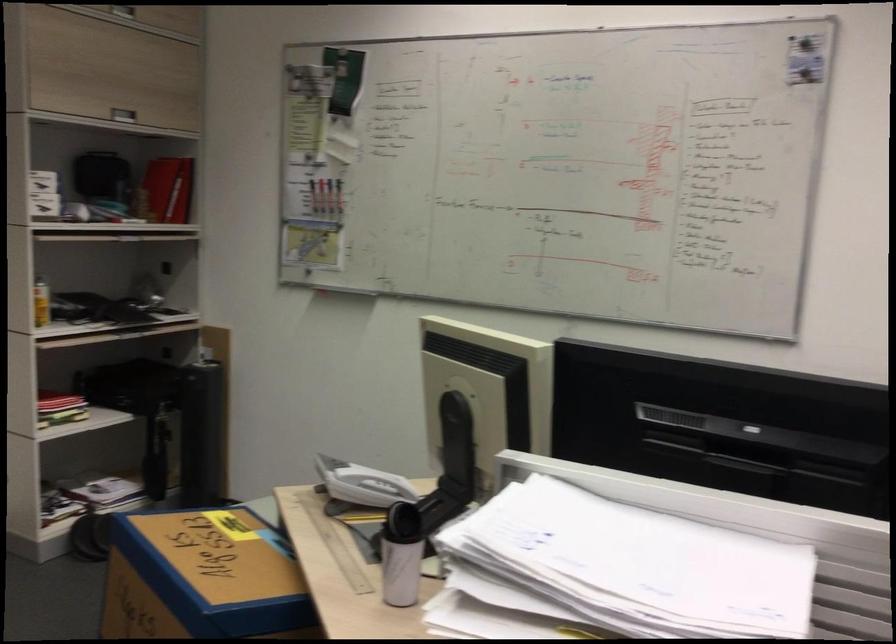
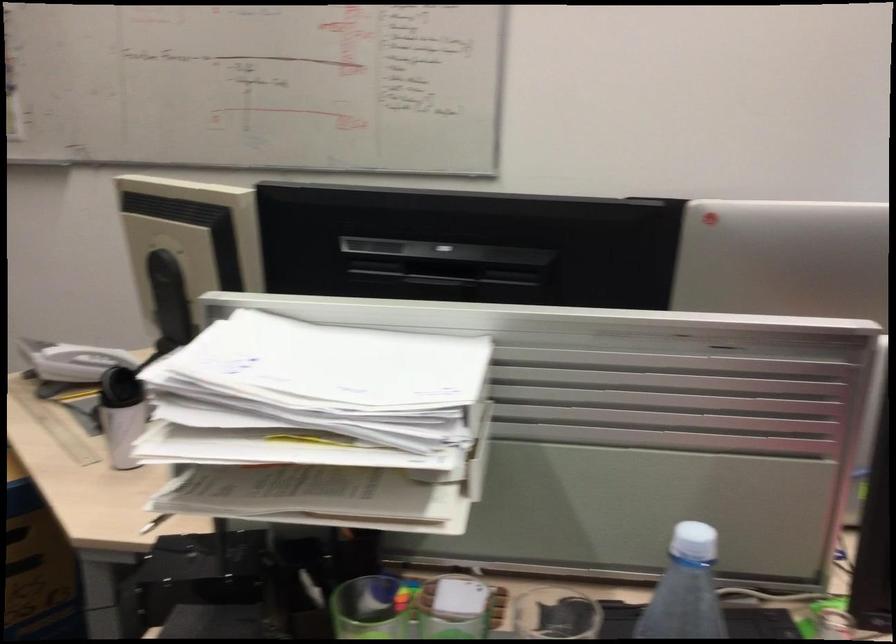
Question: The images are taken continuously from a first-person perspective. In which direction is your viewpoint rotating?

Choices:
 (A) Left
 (B) Right
 (C) Up
 (D) Down

Answer: (B)